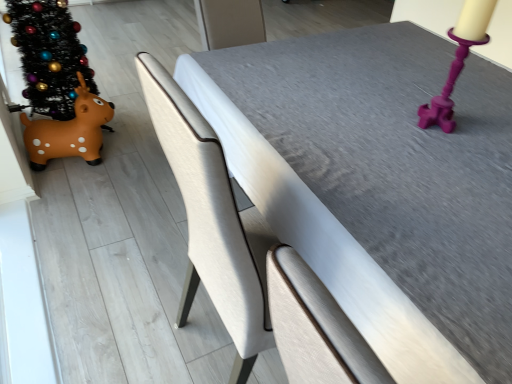
Question: Should I look upward or downward to see brown rubber toy at left?

Choices:
 (A) up
 (B) down

Answer: (A)

Question: Can you confirm if textured gray table at center is shorter than purple plastic candle holder at upper right?

Choices:
 (A) yes
 (B) no

Answer: (B)

Question: Can you confirm if textured gray table at center is thinner than purple plastic candle holder at upper right?

Choices:
 (A) yes
 (B) no

Answer: (B)

Question: Could purple plastic candle holder at upper right be considered to be inside textured gray table at center?

Choices:
 (A) no
 (B) yes

Answer: (A)

Question: Is textured gray table at center to the left of purple plastic candle holder at upper right from the viewer's perspective?

Choices:
 (A) no
 (B) yes

Answer: (B)

Question: From the image's perspective, is textured gray table at center on top of purple plastic candle holder at upper right?

Choices:
 (A) yes
 (B) no

Answer: (B)

Question: From a real-world perspective, is textured gray table at center under purple plastic candle holder at upper right?

Choices:
 (A) no
 (B) yes

Answer: (B)

Question: Is black glittery christmas tree at left shorter than textured gray table at center?

Choices:
 (A) no
 (B) yes

Answer: (B)

Question: Is black glittery christmas tree at left thinner than textured gray table at center?

Choices:
 (A) yes
 (B) no

Answer: (A)

Question: Is black glittery christmas tree at left smaller than textured gray table at center?

Choices:
 (A) yes
 (B) no

Answer: (A)

Question: Is black glittery christmas tree at left facing towards textured gray table at center?

Choices:
 (A) no
 (B) yes

Answer: (A)

Question: Is black glittery christmas tree at left wider than textured gray table at center?

Choices:
 (A) no
 (B) yes

Answer: (A)

Question: From a real-world perspective, is black glittery christmas tree at left located higher than textured gray table at center?

Choices:
 (A) no
 (B) yes

Answer: (B)

Question: Considering the relative sizes of black glittery christmas tree at left and brown rubber toy at left in the image provided, is black glittery christmas tree at left shorter than brown rubber toy at left?

Choices:
 (A) no
 (B) yes

Answer: (A)